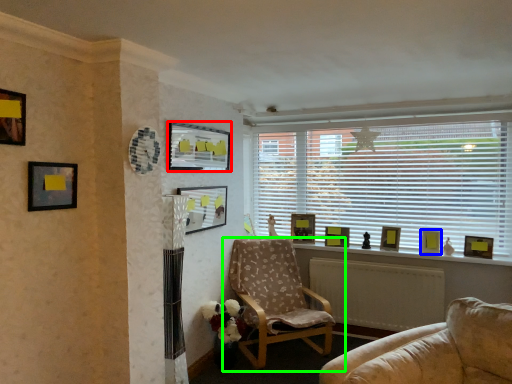
Question: Based on their relative distances, which object is farther from picture frame (highlighted by a red box)? Choose from picture frame (highlighted by a blue box) and chair (highlighted by a green box).

Choices:
 (A) picture frame
 (B) chair

Answer: (A)